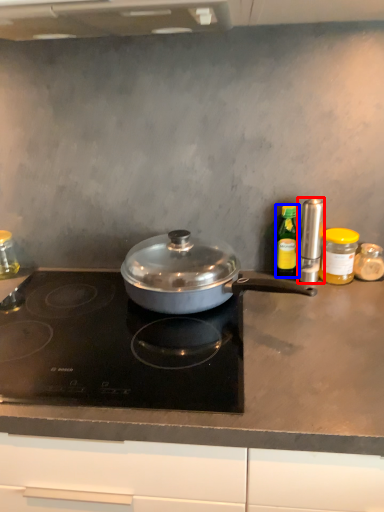
Question: Among these objects, which one is nearest to the camera, kitchen appliance (highlighted by a red box) or kitchen appliance (highlighted by a blue box)?

Choices:
 (A) kitchen appliance
 (B) kitchen appliance

Answer: (A)